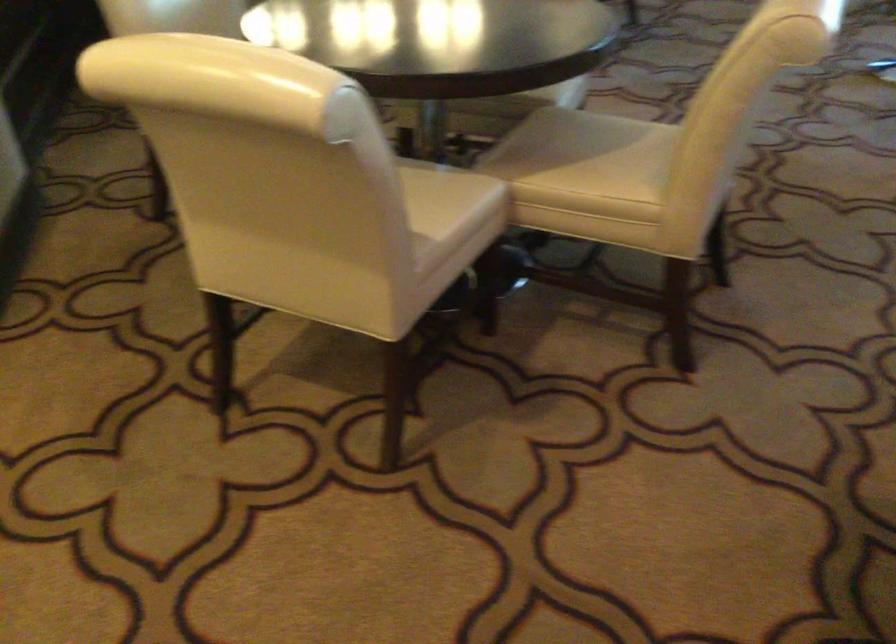
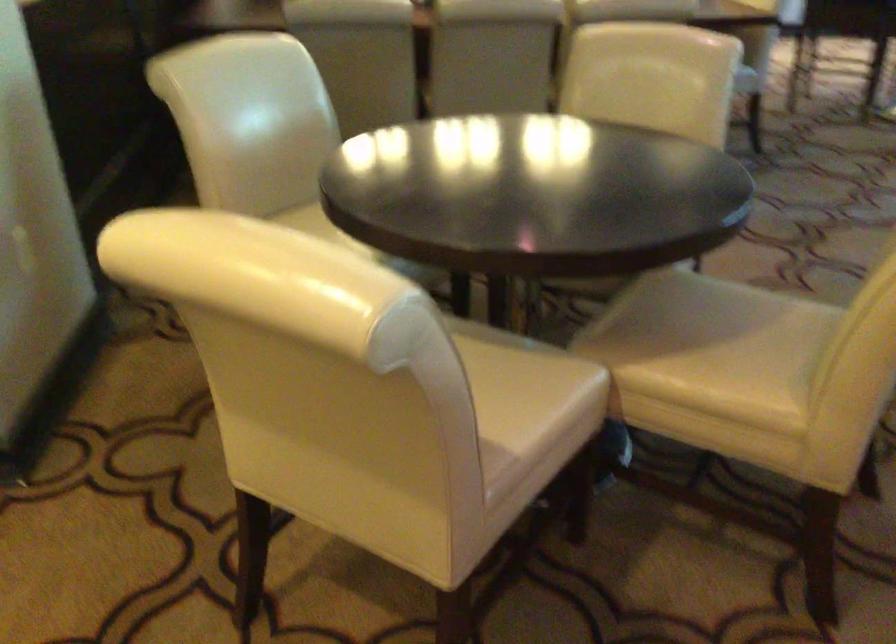
Question: The first image is from the beginning of the video and the second image is from the end. How did the camera likely rotate when shooting the video?

Choices:
 (A) Left
 (B) Right
 (C) Up
 (D) Down

Answer: (A)